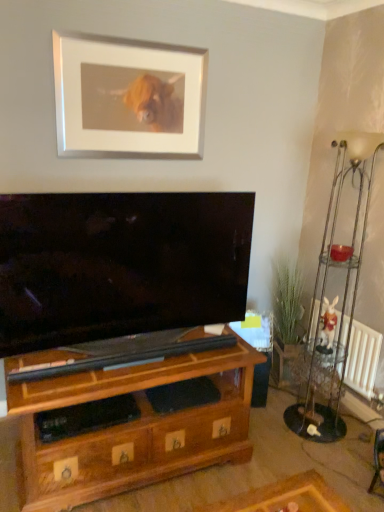
Question: Considering the relative positions of metallic silver side table at right and white matte picture frame at upper center in the image provided, is metallic silver side table at right behind white matte picture frame at upper center?

Choices:
 (A) yes
 (B) no

Answer: (A)

Question: From a real-world perspective, is metallic silver side table at right on top of white matte picture frame at upper center?

Choices:
 (A) yes
 (B) no

Answer: (B)

Question: Is metallic silver side table at right facing away from white matte picture frame at upper center?

Choices:
 (A) yes
 (B) no

Answer: (B)

Question: Are metallic silver side table at right and white matte picture frame at upper center making contact?

Choices:
 (A) no
 (B) yes

Answer: (A)

Question: Considering the relative sizes of metallic silver side table at right and white matte picture frame at upper center in the image provided, is metallic silver side table at right thinner than white matte picture frame at upper center?

Choices:
 (A) no
 (B) yes

Answer: (A)

Question: Considering the relative sizes of metallic silver side table at right and white matte picture frame at upper center in the image provided, is metallic silver side table at right taller than white matte picture frame at upper center?

Choices:
 (A) no
 (B) yes

Answer: (A)

Question: Can you confirm if white plush rabbit at right is positioned to the left of brown wood shelf at lower left?

Choices:
 (A) no
 (B) yes

Answer: (A)

Question: Is white plush rabbit at right at the right side of brown wood shelf at lower left?

Choices:
 (A) yes
 (B) no

Answer: (A)

Question: Can you confirm if white plush rabbit at right is wider than brown wood shelf at lower left?

Choices:
 (A) yes
 (B) no

Answer: (B)

Question: Is the depth of white plush rabbit at right greater than that of brown wood shelf at lower left?

Choices:
 (A) yes
 (B) no

Answer: (A)

Question: From a real-world perspective, is white plush rabbit at right under brown wood shelf at lower left?

Choices:
 (A) no
 (B) yes

Answer: (A)

Question: Is white plush rabbit at right facing towards brown wood shelf at lower left?

Choices:
 (A) no
 (B) yes

Answer: (A)

Question: Is metallic silver floor lamp at right far away from brown wood shelf at lower left?

Choices:
 (A) no
 (B) yes

Answer: (A)